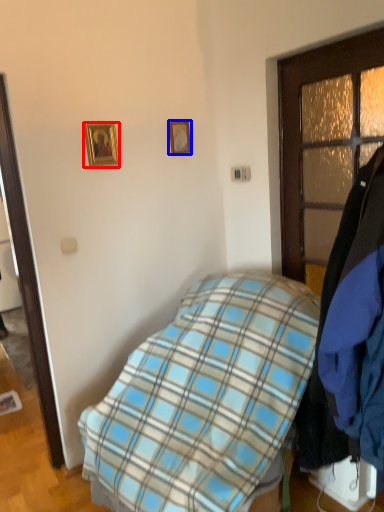
Question: Which of the following is the farthest to the observer, picture frame (highlighted by a red box) or picture frame (highlighted by a blue box)?

Choices:
 (A) picture frame
 (B) picture frame

Answer: (B)